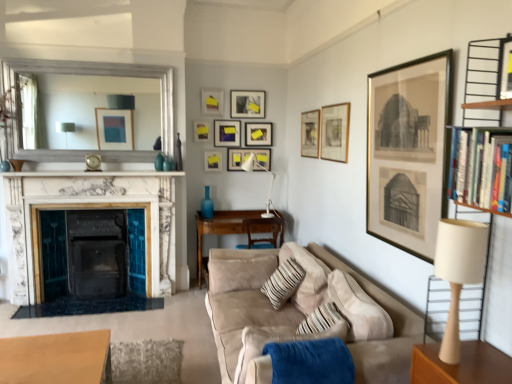
Find the location of a particular element. The height and width of the screenshot is (384, 512). hardcover books at right is located at coordinates click(x=481, y=168).

The height and width of the screenshot is (384, 512). What do you see at coordinates (94, 174) in the screenshot?
I see `marble fireplace at center` at bounding box center [94, 174].

At what (x,y) coordinates should I click in order to perform the action: click on matte yellow picture frame at upper center, which is the fourth picture frame in front-to-back order. Please return your answer as a coordinate pair (x, y). This screenshot has height=384, width=512. Looking at the image, I should click on (212, 101).

This screenshot has width=512, height=384. I want to click on white metal table lamp at center, which ranks as the 1th table lamp in top-to-bottom order, so click(270, 183).

Considering the sizes of objects brown wooden table at center, the 2th table positioned from the front, and beige fabric table lamp at right, which appears as the first table lamp when ordered from the bottom, in the image provided, who is wider, brown wooden table at center, the 2th table positioned from the front, or beige fabric table lamp at right, which appears as the first table lamp when ordered from the bottom,?

brown wooden table at center, the 2th table positioned from the front, is wider.

From their relative heights in the image, would you say brown wooden table at center, which is the 2th table in left-to-right order, is taller or shorter than beige fabric table lamp at right, marked as the 2th table lamp in a top-to-bottom arrangement?

→ In the image, brown wooden table at center, which is the 2th table in left-to-right order, appears to be taller than beige fabric table lamp at right, marked as the 2th table lamp in a top-to-bottom arrangement.

Is brown wooden table at center, the 1th table viewed from the top, placed right next to beige fabric table lamp at right, marked as the 2th table lamp in a top-to-bottom arrangement?

brown wooden table at center, the 1th table viewed from the top, and beige fabric table lamp at right, marked as the 2th table lamp in a top-to-bottom arrangement, are clearly separated.

Looking at this image, considering the positions of objects brown wooden table at center, which appears as the 1th table when viewed from the back, and beige fabric table lamp at right, marked as the 2th table lamp in a top-to-bottom arrangement, in the image provided, who is in front, brown wooden table at center, which appears as the 1th table when viewed from the back, or beige fabric table lamp at right, marked as the 2th table lamp in a top-to-bottom arrangement,?

beige fabric table lamp at right, marked as the 2th table lamp in a top-to-bottom arrangement, is closer to the camera.

What's the angular difference between hardcover books at right and wooden table at lower left, the first table when ordered from left to right,'s facing directions?

The facing directions of hardcover books at right and wooden table at lower left, the first table when ordered from left to right, are 92.3 degrees apart.

Is hardcover books at right looking in the opposite direction of wooden table at lower left, the second table in the back-to-front sequence?

No, hardcover books at right is not facing away from wooden table at lower left, the second table in the back-to-front sequence.

Considering the sizes of hardcover books at right and wooden table at lower left, which ranks as the 2th table in right-to-left order, in the image, is hardcover books at right bigger or smaller than wooden table at lower left, which ranks as the 2th table in right-to-left order,?

Clearly, hardcover books at right is smaller in size than wooden table at lower left, which ranks as the 2th table in right-to-left order.

Is point (488, 202) closer or farther from the camera than point (100, 356)?

Clearly, point (488, 202) is closer to the camera than point (100, 356).

Between matte black picture frame at upper center, the 3th picture frame positioned from the back, and white marble fireplace at left, which one appears on the left side from the viewer's perspective?

From the viewer's perspective, white marble fireplace at left appears more on the left side.

Locate an element on the screen. The width and height of the screenshot is (512, 384). fireplace on the left of matte black picture frame at upper center, the 3th picture frame positioned from the back is located at coordinates (91, 241).

How different are the orientations of matte black picture frame at upper center, the 3th picture frame positioned from the back, and white marble fireplace at left in degrees?

The angular difference between matte black picture frame at upper center, the 3th picture frame positioned from the back, and white marble fireplace at left is 0.348 degrees.

From the image's perspective, relative to white marble fireplace at left, is matte black picture frame at upper center, the 3th picture frame positioned from the back, above or below?

matte black picture frame at upper center, the 3th picture frame positioned from the back, is above white marble fireplace at left.

Which is behind, matte black picture frame at upper center, positioned as the sixth picture frame in front-to-back order, or blue soft fabric blanket at lower center?

matte black picture frame at upper center, positioned as the sixth picture frame in front-to-back order, is further from the camera.

Between point (259, 98) and point (316, 342), which one is positioned in front?

The point (316, 342) is closer.

Is matte black picture frame at upper center, the 5th picture frame positioned from the back, not within blue soft fabric blanket at lower center?

Absolutely, matte black picture frame at upper center, the 5th picture frame positioned from the back, is external to blue soft fabric blanket at lower center.

Consider the image. How much distance is there between matte black picture frame at upper center, the 5th picture frame positioned from the back, and blue soft fabric blanket at lower center?

matte black picture frame at upper center, the 5th picture frame positioned from the back, is 3.70 meters away from blue soft fabric blanket at lower center.

Considering the points (153, 206) and (110, 175), which point is behind, point (153, 206) or point (110, 175)?

Point (153, 206)

Is white marble fireplace at left positioned far away from marble fireplace at center?

No.

Is marble fireplace at center located within white marble fireplace at left?

No, marble fireplace at center is not surrounded by white marble fireplace at left.

How different are the orientations of striped fabric pillow at center and matte black picture frame at upper center, which is the tenth picture frame in front-to-back order, in degrees?

92.6 degrees separate the facing orientations of striped fabric pillow at center and matte black picture frame at upper center, which is the tenth picture frame in front-to-back order.

Based on the photo, can you confirm if striped fabric pillow at center is taller than matte black picture frame at upper center, which is the tenth picture frame in front-to-back order?

A: Yes, striped fabric pillow at center is taller than matte black picture frame at upper center, which is the tenth picture frame in front-to-back order.

Between striped fabric pillow at center and matte black picture frame at upper center, which is the tenth picture frame in front-to-back order, which one is positioned behind?

matte black picture frame at upper center, which is the tenth picture frame in front-to-back order, is more distant.

Can matte black picture frame at upper center, the 5th picture frame positioned from the back, be found inside white metal table lamp at center, arranged as the 1th table lamp when viewed from the back?

No, matte black picture frame at upper center, the 5th picture frame positioned from the back, is not inside white metal table lamp at center, arranged as the 1th table lamp when viewed from the back.

Is the position of white metal table lamp at center, positioned as the 2th table lamp in right-to-left order, more distant than that of matte black picture frame at upper center, the 5th picture frame positioned from the back?

No, it is not.

From the image's perspective, would you say white metal table lamp at center, the second table lamp viewed from the front, is shown under matte black picture frame at upper center, the 5th picture frame positioned from the back?

Yes, from the image's perspective, white metal table lamp at center, the second table lamp viewed from the front, is beneath matte black picture frame at upper center, the 5th picture frame positioned from the back.

I want to click on table that is the 1st object to the left of the beige fabric table lamp at right, acting as the 2th table lamp starting from the back, starting at the anchor, so click(233, 229).

Image resolution: width=512 pixels, height=384 pixels. I want to click on the 2nd table below when counting from the hardcover books at right (from the image's perspective), so click(x=56, y=358).

Which object lies nearer to the anchor point matte gold picture frame at upper right, marked as the 9th picture frame in a back-to-front arrangement, matte black picture frame at upper center, positioned as the 6th picture frame in back-to-front order, or matte black picture frame at upper center, the 5th picture frame positioned from the back?

matte black picture frame at upper center, the 5th picture frame positioned from the back, is positioned closer to the anchor matte gold picture frame at upper right, marked as the 9th picture frame in a back-to-front arrangement.

When comparing their distances from blue soft fabric blanket at lower center, does striped fabric pillow at center or white metal table lamp at center, positioned as the 2th table lamp in right-to-left order, seem further?

The object further to blue soft fabric blanket at lower center is white metal table lamp at center, positioned as the 2th table lamp in right-to-left order.

Consider the image. Based on their spatial positions, is blue soft fabric blanket at lower center or matte gold picture frame at upper center, the 3th picture frame in the front-to-back sequence, closer to brown wooden table at center, the 1th table viewed from the top?

Based on the image, matte gold picture frame at upper center, the 3th picture frame in the front-to-back sequence, appears to be nearer to brown wooden table at center, the 1th table viewed from the top.

Estimate the real-world distances between objects in this image. Which object is further from matte black picture frame at upper center, positioned as the sixth picture frame in front-to-back order, suede couch at lower right or white metal table lamp at center, arranged as the 1th table lamp when viewed from the back?

The object further to matte black picture frame at upper center, positioned as the sixth picture frame in front-to-back order, is suede couch at lower right.

Based on their spatial positions, is marble fireplace at center or blue soft fabric blanket at lower center closer to wooden table at lower left, which ranks as the 2th table in right-to-left order?

blue soft fabric blanket at lower center is positioned closer to the anchor wooden table at lower left, which ranks as the 2th table in right-to-left order.

Based on their spatial positions, is striped fabric pillow at center or matte gold picture frame at upper right, which ranks as the second picture frame in front-to-back order, further from blue soft fabric blanket at lower center?

matte gold picture frame at upper right, which ranks as the second picture frame in front-to-back order.

Looking at the image, which one is located closer to wooden table at lower left, the second table in the back-to-front sequence, gold-framed print at upper right, the 1th picture frame viewed from the front, or matte yellow picture frame at upper center, which is the 7th picture frame from front to back?

Among the two, gold-framed print at upper right, the 1th picture frame viewed from the front, is located nearer to wooden table at lower left, the second table in the back-to-front sequence.

Looking at the image, which one is located further to matte gold picture frame at upper center, the 3th picture frame in the front-to-back sequence, wooden table at lower left, which is the 1th table from bottom to top, or gold-framed print at upper right, the 1th picture frame viewed from the front?

Among the two, wooden table at lower left, which is the 1th table from bottom to top, is located further to matte gold picture frame at upper center, the 3th picture frame in the front-to-back sequence.

Locate an element on the screen. The image size is (512, 384). pillow located between blue soft fabric blanket at lower center and matte gold picture frame at upper center, which is counted as the 8th picture frame, starting from the back, in the depth direction is located at coordinates (283, 283).

At what (x,y) coordinates should I click in order to perform the action: click on studio couch positioned between hardcover books at right and white metal table lamp at center, positioned as the 2th table lamp in right-to-left order, from near to far. Please return your answer as a coordinate pair (x, y). The width and height of the screenshot is (512, 384). Looking at the image, I should click on (306, 310).

I want to click on table lamp between matte black picture frame at upper center, the fifth picture frame when ordered from front to back, and matte gold picture frame at upper center, which is counted as the 8th picture frame, starting from the back, from left to right, so click(x=270, y=183).

Image resolution: width=512 pixels, height=384 pixels. What are the coordinates of `pillow between blue soft fabric blanket at lower center and matte black picture frame at upper center, which is the 8th picture frame from front to back, from front to back` in the screenshot? It's located at (283, 283).